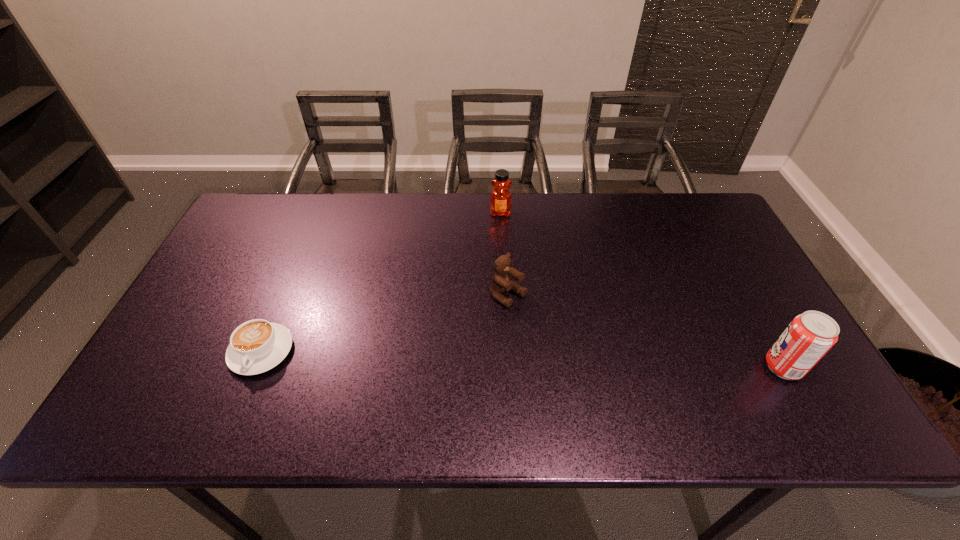
Where is `vacant spot on the desktop that is between the leftmost object and the rightmost object and is positioned on the front label of the farthest object`? vacant spot on the desktop that is between the leftmost object and the rightmost object and is positioned on the front label of the farthest object is located at coordinates (496, 358).

At what (x,y) coordinates should I click in order to perform the action: click on free spot on the desktop that is between the cappuccino and the soda can and is positioned on the face of the third tallest object. Please return your answer as a coordinate pair (x, y). Looking at the image, I should click on (594, 361).